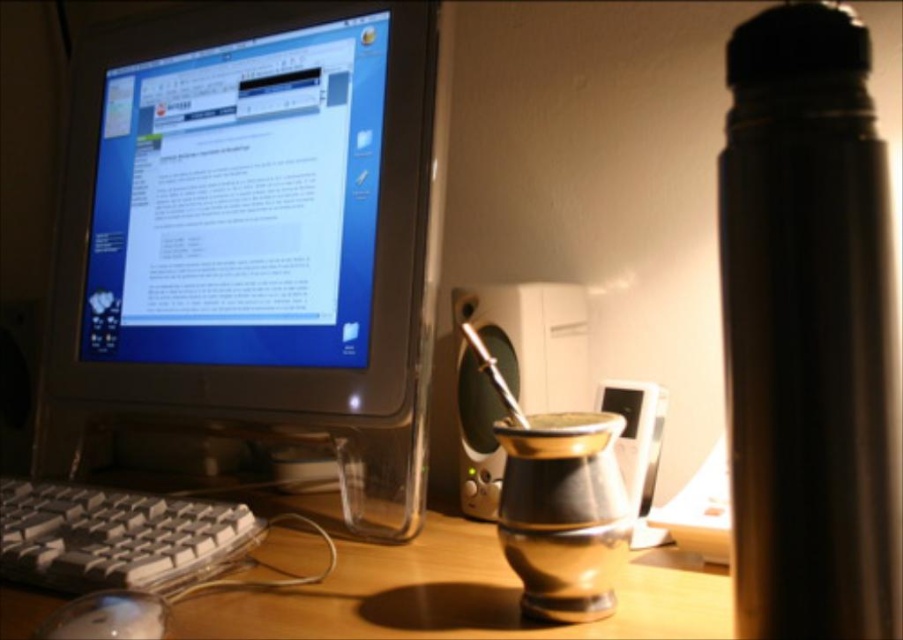
Question: Does metallic brass gourd at center have a smaller size compared to white plastic mouse at lower left?

Choices:
 (A) no
 (B) yes

Answer: (A)

Question: Which point appears closest to the camera in this image?

Choices:
 (A) (452, 586)
 (B) (147, 600)

Answer: (B)

Question: Which object is the farthest from the white plastic mouse at lower left?

Choices:
 (A) white plastic keyboard at lower left
 (B) metallic brass gourd at center
 (C) matte plastic monitor at upper left

Answer: (C)

Question: Can you confirm if metallic brass gourd at center is thinner than white plastic mouse at lower left?

Choices:
 (A) no
 (B) yes

Answer: (A)

Question: Where is metallic brass gourd at center located in relation to white plastic mouse at lower left in the image?

Choices:
 (A) left
 (B) right

Answer: (B)

Question: Which of the following is the farthest from the observer?

Choices:
 (A) white plastic mouse at lower left
 (B) matte plastic monitor at upper left
 (C) white plastic keyboard at lower left
 (D) metallic brass gourd at center

Answer: (B)